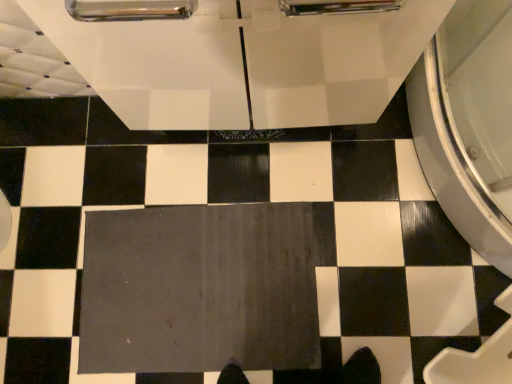
Where is `vacant region below dark gray rubber bath mat at center (from a real-world perspective)`? Image resolution: width=512 pixels, height=384 pixels. vacant region below dark gray rubber bath mat at center (from a real-world perspective) is located at coordinates (196, 291).